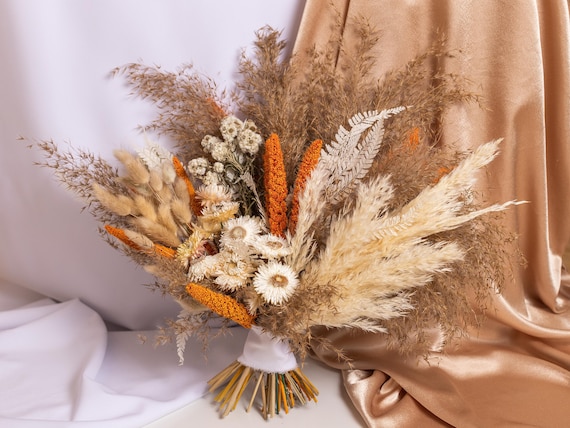
Locate an element on the screen. The width and height of the screenshot is (570, 428). white fabric backdrop is located at coordinates (101, 364).